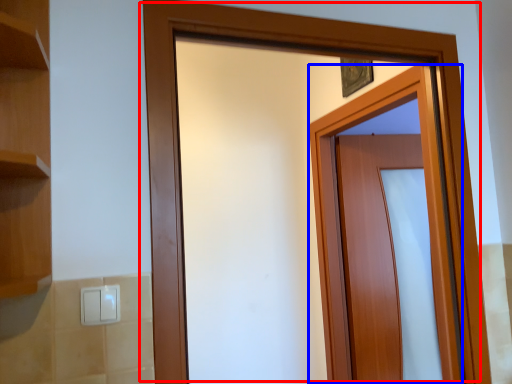
Question: Which point is further to the camera, door (highlighted by a red box) or door (highlighted by a blue box)?

Choices:
 (A) door
 (B) door

Answer: (B)